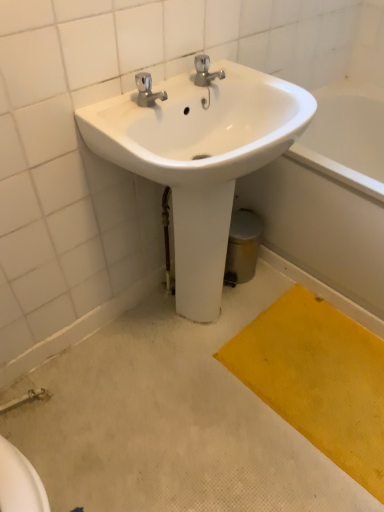
Image resolution: width=384 pixels, height=512 pixels. Describe the element at coordinates (318, 379) in the screenshot. I see `yellow fabric doormat at lower right` at that location.

You are a GUI agent. You are given a task and a screenshot of the screen. Output one action in this format:
    pyautogui.click(x=<x>, y=<y>)
    Task: Click on the white glossy bathtub at lower right
    The image size is (384, 512).
    Given the screenshot: What is the action you would take?
    pyautogui.click(x=321, y=225)

The height and width of the screenshot is (512, 384). I want to click on white glossy sink at upper center, so click(200, 158).

Identify the location of yellow fabric doormat at lower right. click(318, 379).

What are the coordinates of `sink that is below the white glossy bathtub at lower right (from the image's perspective)` in the screenshot? It's located at (200, 158).

From a real-world perspective, who is located higher, white glossy sink at upper center or white glossy bathtub at lower right?

white glossy sink at upper center, from a real-world perspective.

Would you say white glossy sink at upper center is outside white glossy bathtub at lower right?

Yes, white glossy sink at upper center is located beyond the bounds of white glossy bathtub at lower right.

From their relative heights in the image, would you say white glossy sink at upper center is taller or shorter than white glossy bathtub at lower right?

In the image, white glossy sink at upper center appears to be taller than white glossy bathtub at lower right.

In the scene shown: From a real-world perspective, is white glossy sink at upper center above or below yellow fabric doormat at lower right?

In terms of real-world spatial position, white glossy sink at upper center is above yellow fabric doormat at lower right.

You are a GUI agent. You are given a task and a screenshot of the screen. Output one action in this format:
    pyautogui.click(x=<x>, y=<y>)
    Task: Click on the sink above the yellow fabric doormat at lower right (from a real-world perspective)
    This screenshot has height=512, width=384.
    Given the screenshot: What is the action you would take?
    pyautogui.click(x=200, y=158)

Can you confirm if white glossy sink at upper center is bigger than yellow fabric doormat at lower right?

Yes, white glossy sink at upper center is bigger than yellow fabric doormat at lower right.

Between white glossy sink at upper center and yellow fabric doormat at lower right, which one has larger width?

Wider between the two is yellow fabric doormat at lower right.

From a real-world perspective, is white glossy bathtub at lower right positioned above or below white glossy sink at upper center?

white glossy bathtub at lower right is situated lower than white glossy sink at upper center in the real world.

Would you say white glossy bathtub at lower right is outside white glossy sink at upper center?

Yes, white glossy bathtub at lower right is not within white glossy sink at upper center.

In the scene shown: Relative to white glossy sink at upper center, is white glossy bathtub at lower right in front or behind?

In the image, white glossy bathtub at lower right appears behind white glossy sink at upper center.

Based on the photo, is white glossy bathtub at lower right to the left or to the right of yellow fabric doormat at lower right in the image?

white glossy bathtub at lower right is positioned on yellow fabric doormat at lower right's right side.

From the image's perspective, who appears lower, white glossy bathtub at lower right or yellow fabric doormat at lower right?

yellow fabric doormat at lower right, from the image's perspective.

Who is bigger, white glossy bathtub at lower right or yellow fabric doormat at lower right?

With larger size is white glossy bathtub at lower right.

How far apart are white glossy bathtub at lower right and yellow fabric doormat at lower right?

white glossy bathtub at lower right and yellow fabric doormat at lower right are 13.12 inches apart.

In the image, there is a white glossy sink at upper center. At what (x,y) coordinates should I click in order to perform the action: click on doormat below it (from a real-world perspective). Please return your answer as a coordinate pair (x, y). Image resolution: width=384 pixels, height=512 pixels. Looking at the image, I should click on (318, 379).

Is white glossy sink at upper center at the back of yellow fabric doormat at lower right?

No, white glossy sink at upper center is not at the back of yellow fabric doormat at lower right.

From a real-world perspective, relative to white glossy sink at upper center, is yellow fabric doormat at lower right vertically above or below?

Clearly, from a real-world perspective, yellow fabric doormat at lower right is below white glossy sink at upper center.

From the image's perspective, which is above, yellow fabric doormat at lower right or white glossy sink at upper center?

From the image's view, white glossy sink at upper center is above.

From the image's perspective, which one is positioned lower, yellow fabric doormat at lower right or white glossy bathtub at lower right?

From the image's view, yellow fabric doormat at lower right is below.

Would you consider yellow fabric doormat at lower right to be distant from white glossy bathtub at lower right?

Actually, yellow fabric doormat at lower right and white glossy bathtub at lower right are a little close together.

Which is farther, (337, 391) or (280, 178)?

The point (280, 178) is behind.

This screenshot has height=512, width=384. In order to click on sink on the left of the white glossy bathtub at lower right in this screenshot , I will do `click(200, 158)`.

Find the location of a particular element. The height and width of the screenshot is (512, 384). doormat below the white glossy sink at upper center (from a real-world perspective) is located at coordinates (318, 379).

From the image, which object appears to be nearer to white glossy sink at upper center, white glossy bathtub at lower right or yellow fabric doormat at lower right?

white glossy bathtub at lower right is closer to white glossy sink at upper center.

When comparing their distances from white glossy bathtub at lower right, does white glossy sink at upper center or yellow fabric doormat at lower right seem further?

Among the two, white glossy sink at upper center is located further to white glossy bathtub at lower right.

Based on their spatial positions, is white glossy sink at upper center or white glossy bathtub at lower right closer to yellow fabric doormat at lower right?

Among the two, white glossy bathtub at lower right is located nearer to yellow fabric doormat at lower right.

Considering their positions, is yellow fabric doormat at lower right positioned further to white glossy sink at upper center than white glossy bathtub at lower right?

yellow fabric doormat at lower right is further to white glossy sink at upper center.

Which object lies further to the anchor point yellow fabric doormat at lower right, white glossy bathtub at lower right or white glossy sink at upper center?

Based on the image, white glossy sink at upper center appears to be further to yellow fabric doormat at lower right.

When comparing their distances from white glossy bathtub at lower right, does yellow fabric doormat at lower right or white glossy sink at upper center seem further?

Based on the image, white glossy sink at upper center appears to be further to white glossy bathtub at lower right.

The height and width of the screenshot is (512, 384). I want to click on sink between white glossy bathtub at lower right and yellow fabric doormat at lower right vertically, so click(200, 158).